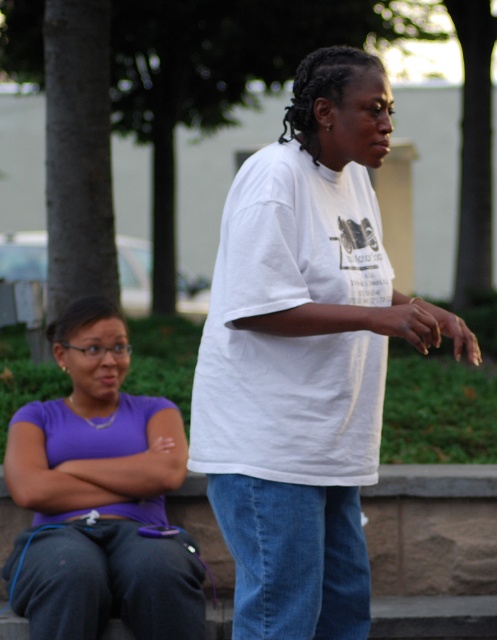
Between point (358, 547) and point (39, 618), which one is positioned behind?

Positioned behind is point (39, 618).

Does white cotton shirt at center have a lesser height compared to purple matte shirt at center?

No, white cotton shirt at center is not shorter than purple matte shirt at center.

What are the coordinates of `white cotton shirt at center` in the screenshot? It's located at (305, 356).